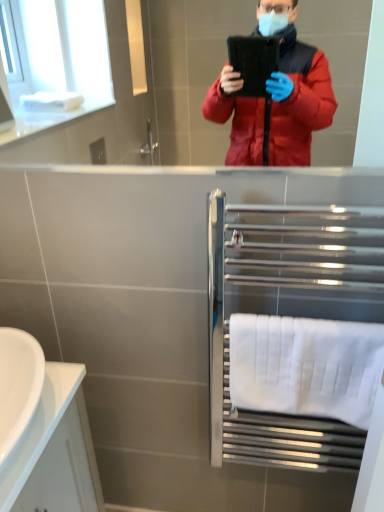
Question: Is polished chrome towel rack at lower right bigger than white glossy sink at lower left?

Choices:
 (A) yes
 (B) no

Answer: (A)

Question: Can you confirm if polished chrome towel rack at lower right is taller than white glossy sink at lower left?

Choices:
 (A) yes
 (B) no

Answer: (A)

Question: Does polished chrome towel rack at lower right appear on the left side of white glossy sink at lower left?

Choices:
 (A) yes
 (B) no

Answer: (B)

Question: Is polished chrome towel rack at lower right shorter than white glossy sink at lower left?

Choices:
 (A) no
 (B) yes

Answer: (A)

Question: Is polished chrome towel rack at lower right smaller than white glossy sink at lower left?

Choices:
 (A) no
 (B) yes

Answer: (A)

Question: Does point (1, 384) appear closer or farther from the camera than point (294, 251)?

Choices:
 (A) farther
 (B) closer

Answer: (B)

Question: Would you say white glossy sink at lower left is to the left or to the right of polished chrome towel rack at lower right in the picture?

Choices:
 (A) left
 (B) right

Answer: (A)

Question: Considering the positions of white glossy sink at lower left and polished chrome towel rack at lower right in the image, is white glossy sink at lower left bigger or smaller than polished chrome towel rack at lower right?

Choices:
 (A) big
 (B) small

Answer: (B)

Question: Considering the positions of white glossy sink at lower left and polished chrome towel rack at lower right in the image, is white glossy sink at lower left wider or thinner than polished chrome towel rack at lower right?

Choices:
 (A) wide
 (B) thin

Answer: (A)

Question: Looking at their shapes, would you say white cotton towel at lower right is wider or thinner than white glossy sink at lower left?

Choices:
 (A) wide
 (B) thin

Answer: (B)

Question: In terms of height, does white cotton towel at lower right look taller or shorter compared to white glossy sink at lower left?

Choices:
 (A) short
 (B) tall

Answer: (B)

Question: Is point (309, 392) closer or farther from the camera than point (1, 437)?

Choices:
 (A) farther
 (B) closer

Answer: (A)

Question: From a real-world perspective, is white cotton towel at lower right above or below white glossy sink at lower left?

Choices:
 (A) below
 (B) above

Answer: (A)

Question: Is white glossy sink at lower left bigger or smaller than white cotton towel at lower right?

Choices:
 (A) big
 (B) small

Answer: (A)

Question: Considering their positions, is white glossy sink at lower left located in front of or behind white cotton towel at lower right?

Choices:
 (A) behind
 (B) front

Answer: (B)